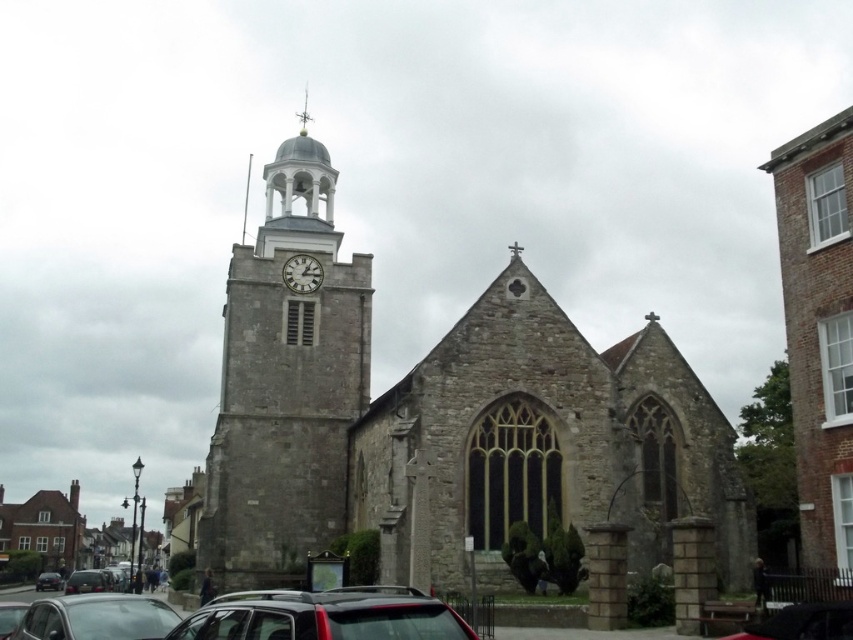
Question: Can you confirm if gray stone church at center is thinner than satin black car at lower center?

Choices:
 (A) yes
 (B) no

Answer: (B)

Question: Which point is closer to the camera?

Choices:
 (A) gray stone church at center
 (B) metallic silver car at lower left
 (C) matte black car at lower left
 (D) white stone clock at center

Answer: (B)

Question: Which object is farther from the camera taking this photo?

Choices:
 (A) gray stone church at center
 (B) satin black car at lower center
 (C) white stone clock at center
 (D) matte black car at lower left

Answer: (D)

Question: Which point is closer to the camera taking this photo?

Choices:
 (A) (236, 248)
 (B) (221, 508)

Answer: (B)

Question: Does brown brick church at right come in front of shiny silver car at lower left?

Choices:
 (A) yes
 (B) no

Answer: (A)

Question: Can you confirm if satin black car at lower center is positioned to the left of white stone clock at center?

Choices:
 (A) yes
 (B) no

Answer: (B)